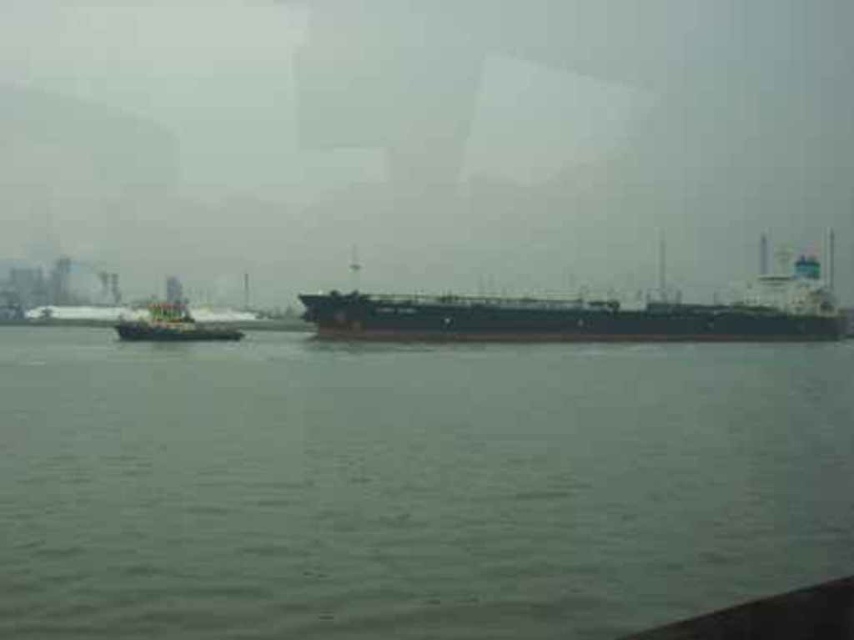
You are a drone operator trying to land a drone on the gray matte water at center. The drone has a landing pad with a radius of 0.5 meters. Can you safely land the drone at the coordinates provided in the description?

The gray matte water at center is located at point (410, 484). Since the landing pad has a radius of 0.5 meters, you can safely land the drone there as long as the coordinates are within the designated area.